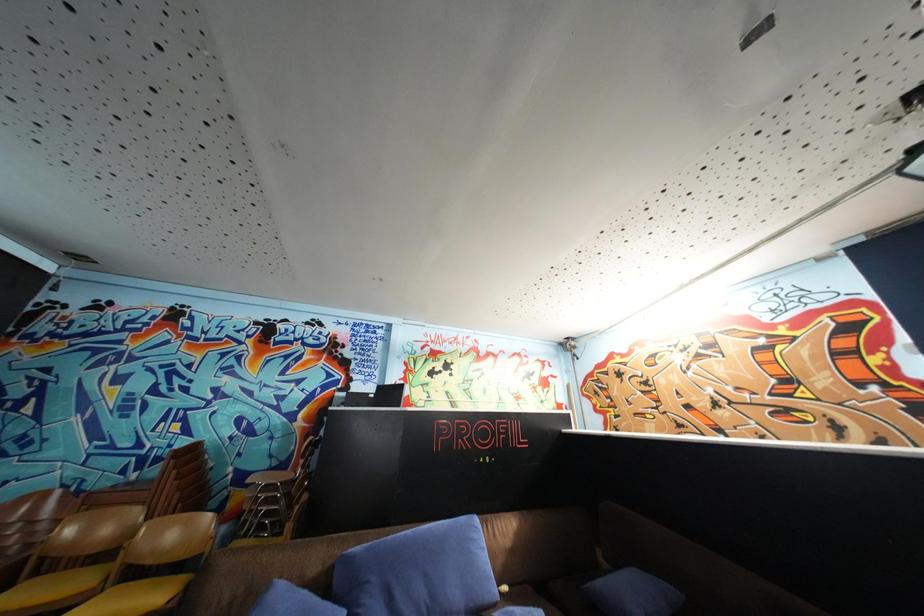
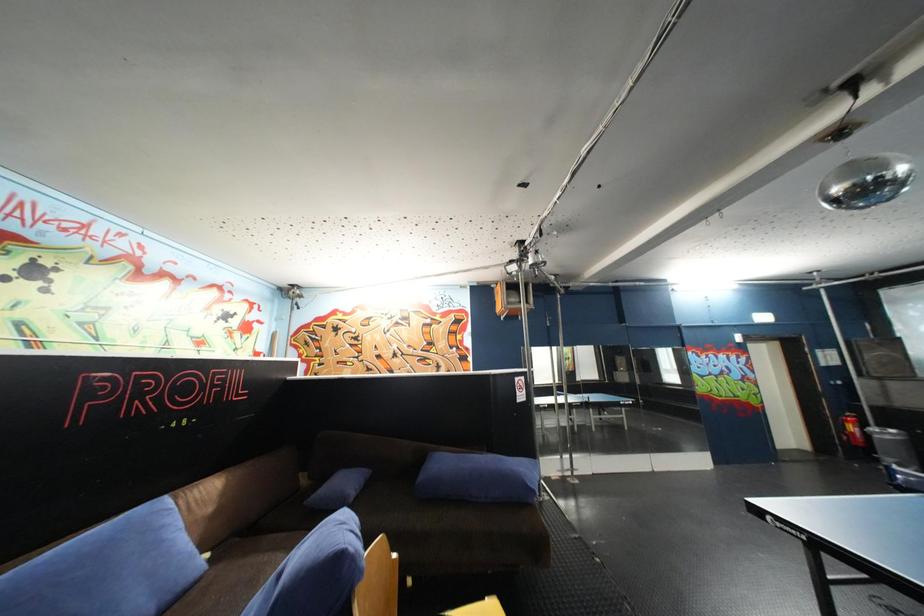
Question: The camera is either moving clockwise (left) or counter-clockwise (right) around the object. The first image is from the beginning of the video and the second image is from the end. Is the camera moving left or right when shooting the video?

Choices:
 (A) Left
 (B) Right

Answer: (A)